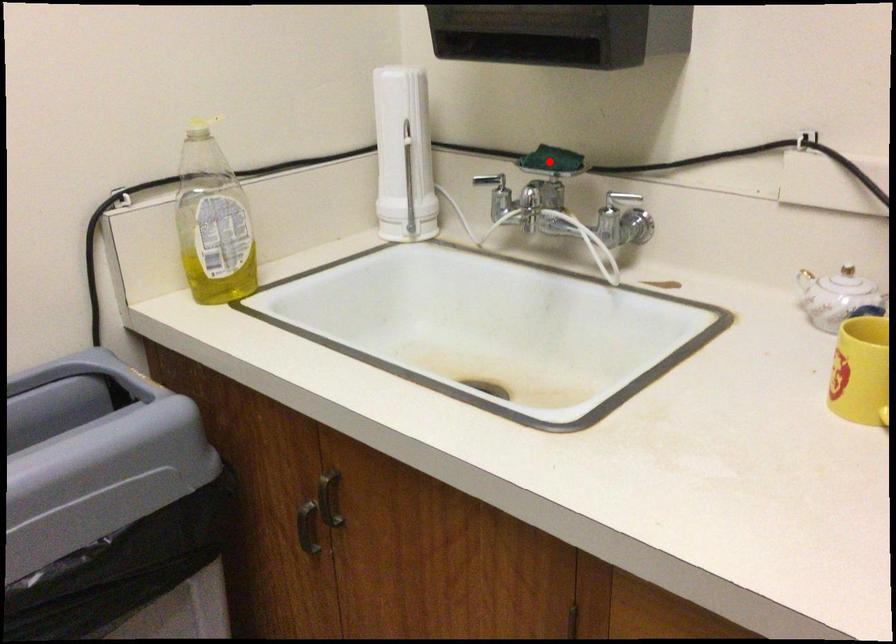
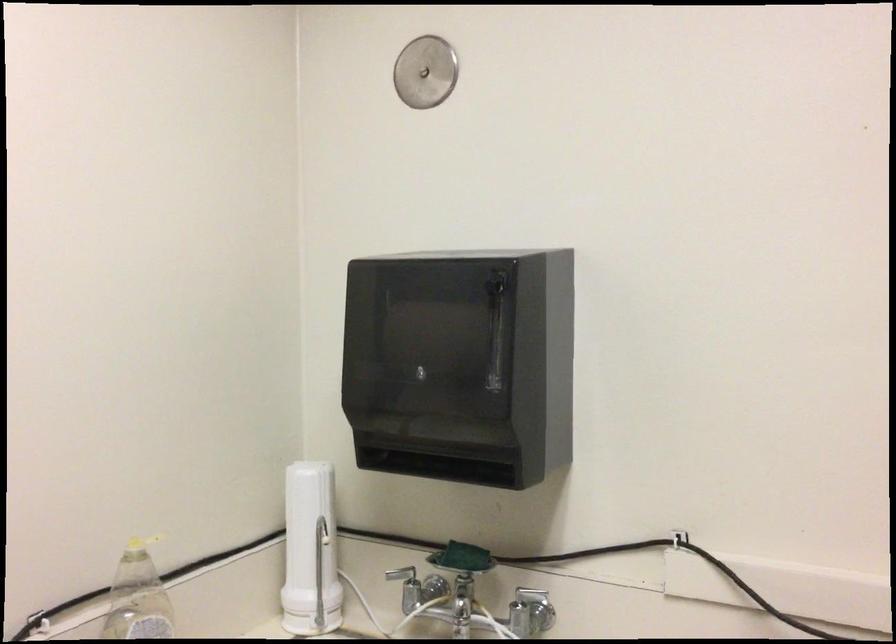
In the second image, find the point that corresponds to the highlighted location in the first image.

(462, 558)